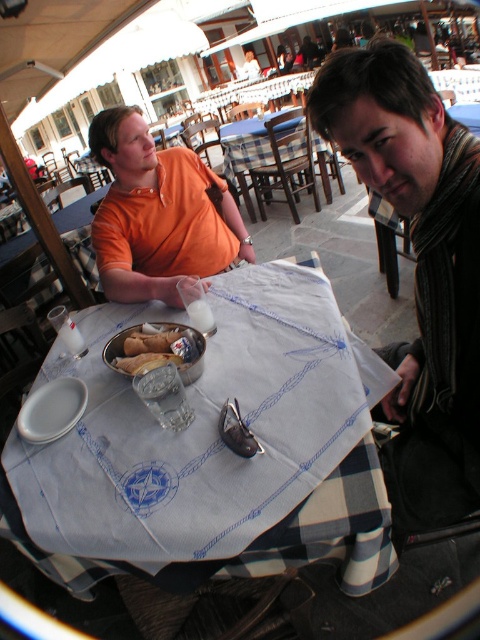
Measure the distance from white cloth at center to orange cotton shirt at upper left.

A distance of 19.00 inches exists between white cloth at center and orange cotton shirt at upper left.

Based on the photo, which is more to the right, white cloth at center or orange cotton shirt at upper left?

white cloth at center is more to the right.

Where is `white cloth at center`? The image size is (480, 640). white cloth at center is located at coordinates (216, 451).

Is white cloth at center in front of bread soft at center?

Yes, it is.

I want to click on white cloth at center, so click(x=216, y=451).

Can you confirm if striped scarf at right is bigger than orange cotton shirt at upper left?

No, striped scarf at right is not bigger than orange cotton shirt at upper left.

Consider the image. Between striped scarf at right and orange cotton shirt at upper left, which one appears on the left side from the viewer's perspective?

From the viewer's perspective, orange cotton shirt at upper left appears more on the left side.

Between point (389, 464) and point (132, 266), which one is positioned behind?

The point (132, 266) is more distant.

What are the coordinates of `striped scarf at right` in the screenshot? It's located at point(419,268).